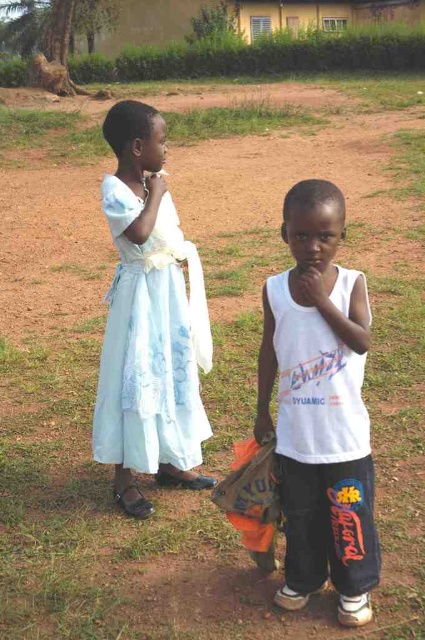
You are a photographer trying to capture a group photo of the white cotton tank top at center and the light blue satin dress at left. If your camera has a maximum focus range of 30 inches, will you be able to capture both subjects clearly in the same photo?

The white cotton tank top at center is 31.32 inches from the light blue satin dress at left. Since the distance between them exceeds the camera maximum focus range of 30 inches, you will not be able to capture both subjects clearly in the same photo.